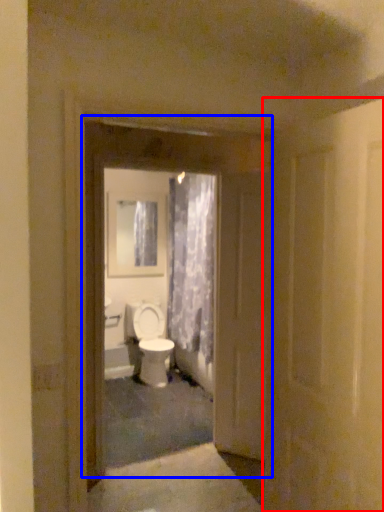
Question: Which point is closer to the camera, door (highlighted by a red box) or door (highlighted by a blue box)?

Choices:
 (A) door
 (B) door

Answer: (A)